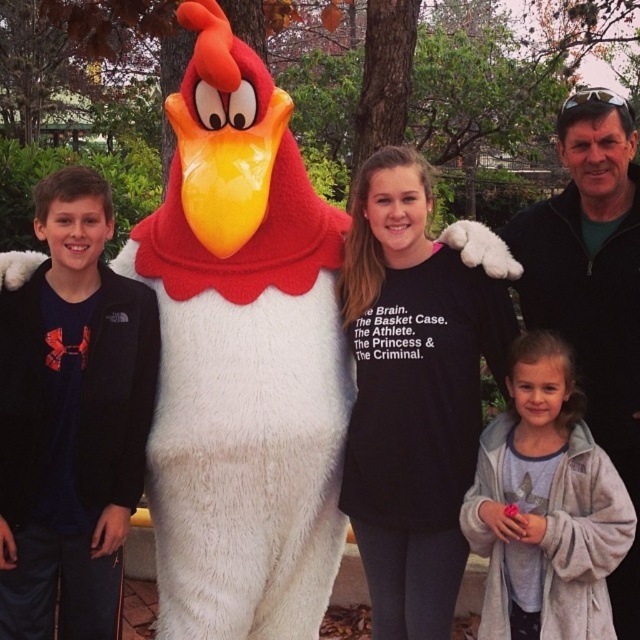
Question: Is black cotton shirt at center thinner than light gray fleece robe at lower right?

Choices:
 (A) yes
 (B) no

Answer: (B)

Question: Is the position of black cotton shirt at center less distant than that of light gray fleece robe at lower right?

Choices:
 (A) no
 (B) yes

Answer: (A)

Question: Which point appears closest to the camera in this image?

Choices:
 (A) (355, 499)
 (B) (483, 541)

Answer: (B)

Question: Does black cotton shirt at center appear under light gray fleece robe at lower right?

Choices:
 (A) yes
 (B) no

Answer: (B)